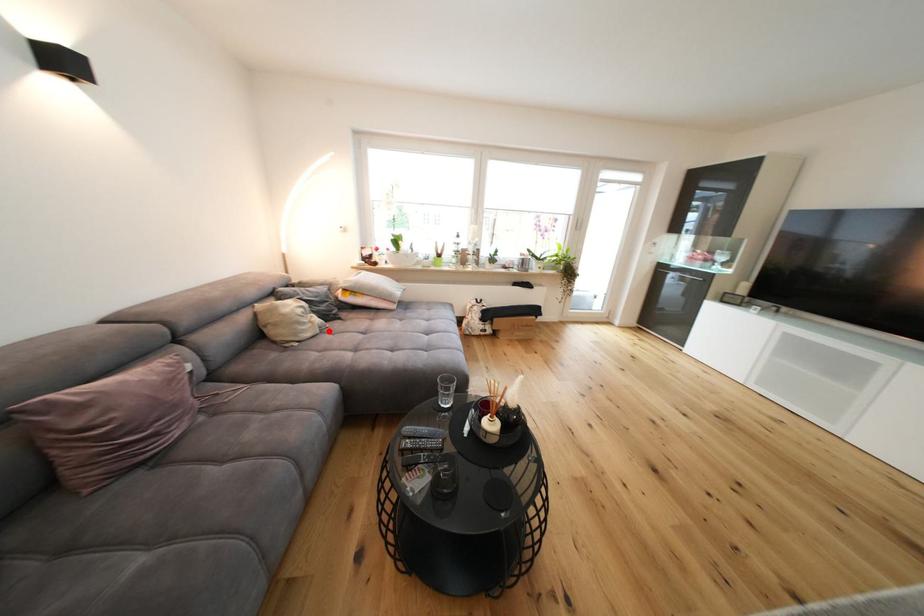
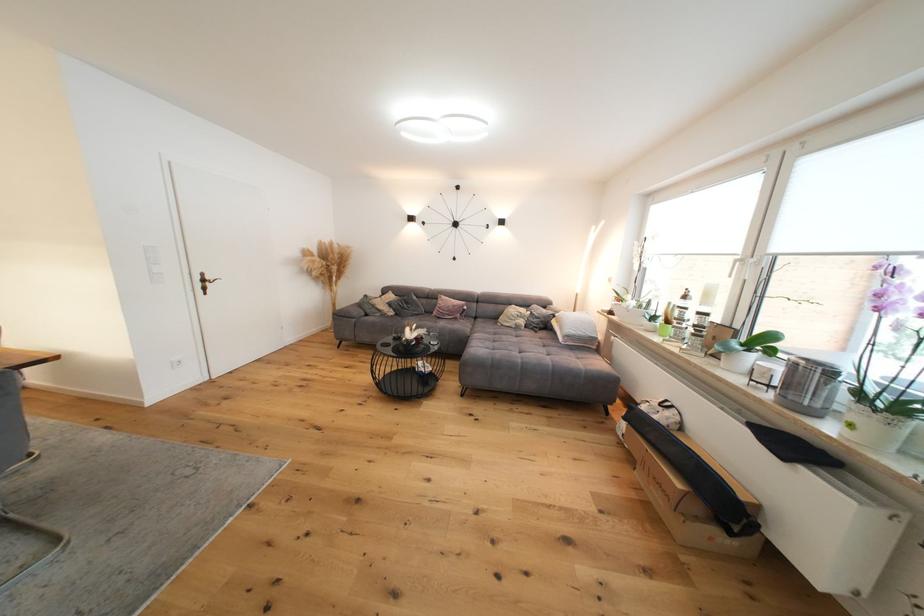
Find the pixel in the second image that matches the highlighted location in the first image.

(524, 330)